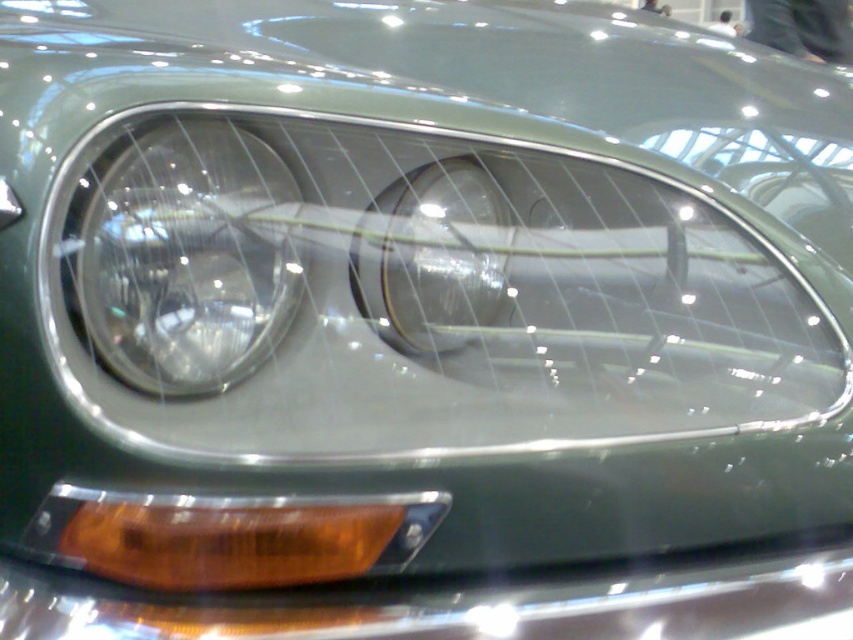
Question: Does clear glass headlight at left have a larger size compared to translucent amber plastic at lower left?

Choices:
 (A) yes
 (B) no

Answer: (A)

Question: Which object is positioned farthest from the clear glass headlight at left?

Choices:
 (A) translucent amber plastic at lower left
 (B) clear glass headlight at center

Answer: (A)

Question: Can you confirm if translucent amber plastic at lower left is smaller than clear glass headlight at center?

Choices:
 (A) no
 (B) yes

Answer: (A)

Question: Observing the image, what is the correct spatial positioning of clear glass headlight at left in reference to clear glass headlight at center?

Choices:
 (A) left
 (B) right

Answer: (A)

Question: Which point is farther to the camera?

Choices:
 (A) (193, 284)
 (B) (292, 525)

Answer: (B)

Question: Which of the following is the farthest from the observer?

Choices:
 (A) clear glass headlight at center
 (B) clear glass headlight at left
 (C) translucent amber plastic at lower left

Answer: (A)